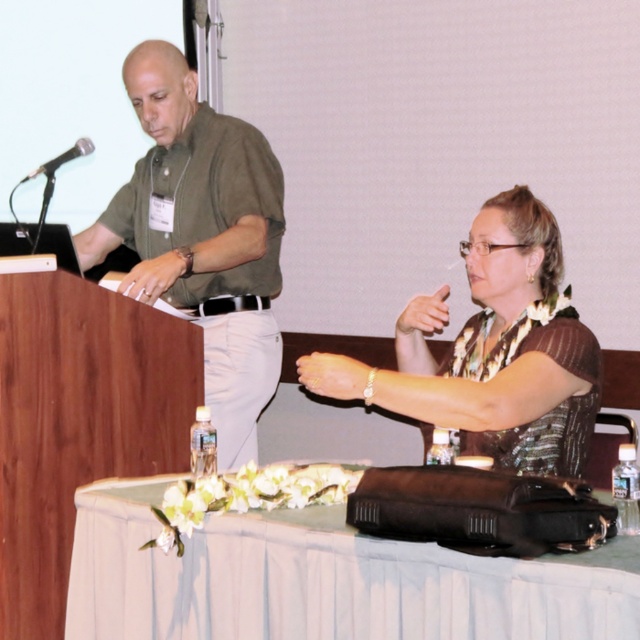
You are standing in front of the conference table and want to place a small object on the table. You have two points to choose from, point (160,124) and point (26,176). Which point is closer to you?

Point (160,124) is closer to the viewer than point (26,176), so you should place the object there.

You are a photographer in the room. You want to take a photo of the brown textured blouse at center and the green matte shirt at left. Based on their positions, which one will appear closer to the camera in the photo?

The green matte shirt at left will appear closer to the camera because the brown textured blouse at center is positioned behind it.

You are an event organizer setting up for a presentation. You have a black metallic microphone at left and a white clothed table at lower center. Can you place the microphone on the table without it falling off the edge?

The white clothed table at lower center might be wider than black metallic microphone at left, so there is a possibility that the microphone can be placed on the table without falling off, but it depends on the exact dimensions.